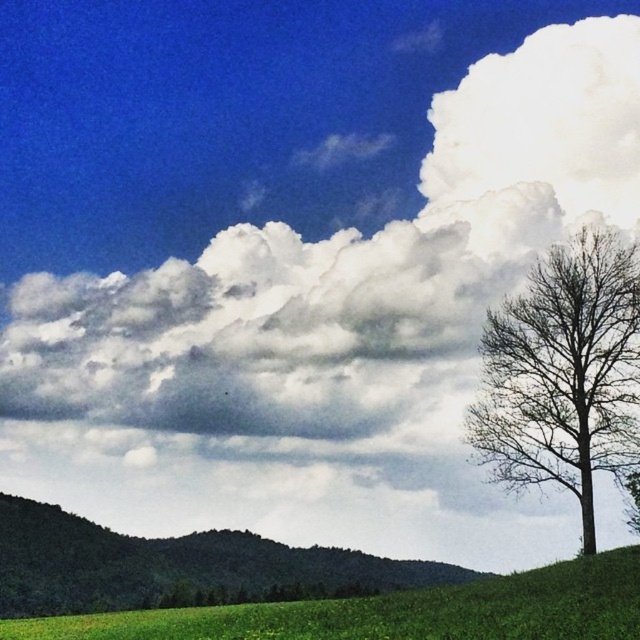
You are a painter setting up your easel to capture the landscape. You want to ensure both the bare wood tree at right and the green grassy hillside at lower left are visible in your painting. Given their sizes, which object should you place closer to the center to maintain balance?

The bare wood tree at right is smaller than the green grassy hillside at lower left. To balance the composition, you should place the larger green grassy hillside at lower left closer to the center since it can anchor the scene effectively while the smaller tree can be positioned slightly off center.

You are a photographer positioned at the camera location. You want to take a photo of the landscape. Which of the two points, point [544,282] or point [96,604], will appear larger in your photo?

Point [544,282] will appear larger in the photo because it is closer to the camera than point [96,604].

You are standing in the middle of the green grassy hillside at lower left and want to look up at the bare wood tree at right. Which direction should you face?

You should face towards the right direction to look up at the bare wood tree at right since it is positioned above the green grassy hillside at lower left.